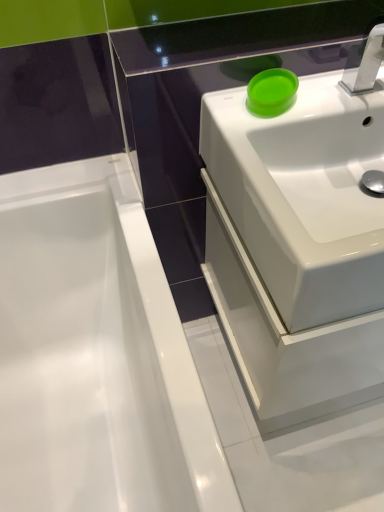
Question: Considering the relative positions of white glossy bathtub at left and silver metallic tap at upper right in the image provided, is white glossy bathtub at left in front of silver metallic tap at upper right?

Choices:
 (A) no
 (B) yes

Answer: (B)

Question: Is white glossy bathtub at left not within silver metallic tap at upper right?

Choices:
 (A) no
 (B) yes

Answer: (B)

Question: From a real-world perspective, is white glossy bathtub at left under silver metallic tap at upper right?

Choices:
 (A) no
 (B) yes

Answer: (B)

Question: From the image's perspective, is white glossy bathtub at left below silver metallic tap at upper right?

Choices:
 (A) yes
 (B) no

Answer: (A)

Question: From a real-world perspective, is white glossy bathtub at left on top of silver metallic tap at upper right?

Choices:
 (A) no
 (B) yes

Answer: (A)

Question: In terms of width, does matte green bowl at upper right look wider or thinner when compared to white glossy sink at upper right?

Choices:
 (A) wide
 (B) thin

Answer: (B)

Question: From a real-world perspective, is matte green bowl at upper right above or below white glossy sink at upper right?

Choices:
 (A) above
 (B) below

Answer: (A)

Question: Is matte green bowl at upper right taller or shorter than white glossy sink at upper right?

Choices:
 (A) tall
 (B) short

Answer: (B)

Question: Relative to white glossy sink at upper right, is matte green bowl at upper right in front or behind?

Choices:
 (A) front
 (B) behind

Answer: (B)

Question: Is silver metallic tap at upper right situated inside white glossy bathtub at left or outside?

Choices:
 (A) inside
 (B) outside

Answer: (B)

Question: Is silver metallic tap at upper right in front of or behind white glossy bathtub at left in the image?

Choices:
 (A) front
 (B) behind

Answer: (B)

Question: From a real-world perspective, is silver metallic tap at upper right physically located above or below white glossy bathtub at left?

Choices:
 (A) below
 (B) above

Answer: (B)

Question: Is point (380, 60) positioned closer to the camera than point (79, 357)?

Choices:
 (A) closer
 (B) farther

Answer: (A)

Question: Would you say white glossy sink at upper right is to the left or to the right of silver metallic tap at upper right in the picture?

Choices:
 (A) right
 (B) left

Answer: (B)

Question: Choose the correct answer: Is white glossy sink at upper right inside silver metallic tap at upper right or outside it?

Choices:
 (A) inside
 (B) outside

Answer: (B)